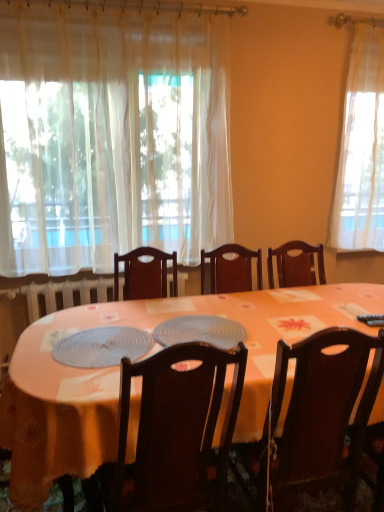
Where is `unoccupied space behind translucent plastic placemat at center, marked as the 2th platter in a left-to-right arrangement`? The width and height of the screenshot is (384, 512). unoccupied space behind translucent plastic placemat at center, marked as the 2th platter in a left-to-right arrangement is located at coordinates (206, 306).